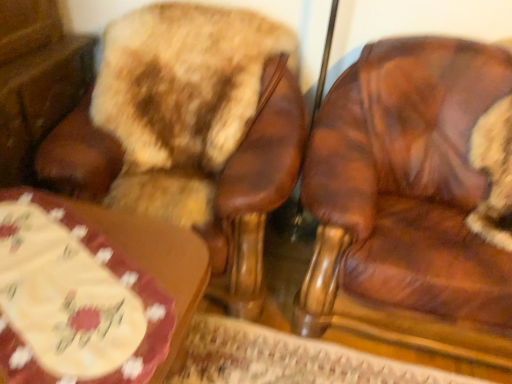
Question: From the image's perspective, is wooden table at lower left above or below brown leather chair at right, marked as the 2th chair in a left-to-right arrangement?

Choices:
 (A) below
 (B) above

Answer: (A)

Question: Considering the positions of wooden table at lower left and brown leather chair at right, which appears as the 1th chair when viewed from the right, in the image, is wooden table at lower left wider or thinner than brown leather chair at right, which appears as the 1th chair when viewed from the right,?

Choices:
 (A) wide
 (B) thin

Answer: (B)

Question: Which of these objects is positioned closest to the brown leather chair at upper left, placed as the first chair when sorted from left to right?

Choices:
 (A) wooden table at lower left
 (B) brown leather chair at right, which appears as the 1th chair when viewed from the right

Answer: (A)

Question: Estimate the real-world distances between objects in this image. Which object is closer to the brown leather chair at right, which appears as the 1th chair when viewed from the right?

Choices:
 (A) brown leather chair at upper left, the second chair viewed from the right
 (B) wooden table at lower left

Answer: (A)